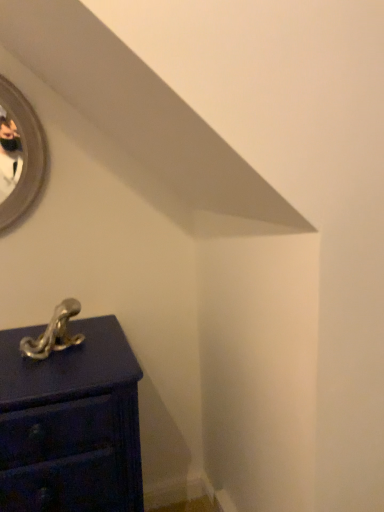
Locate an element on the screen. The width and height of the screenshot is (384, 512). empty space that is to the right of polished silver hook at lower left is located at coordinates (100, 352).